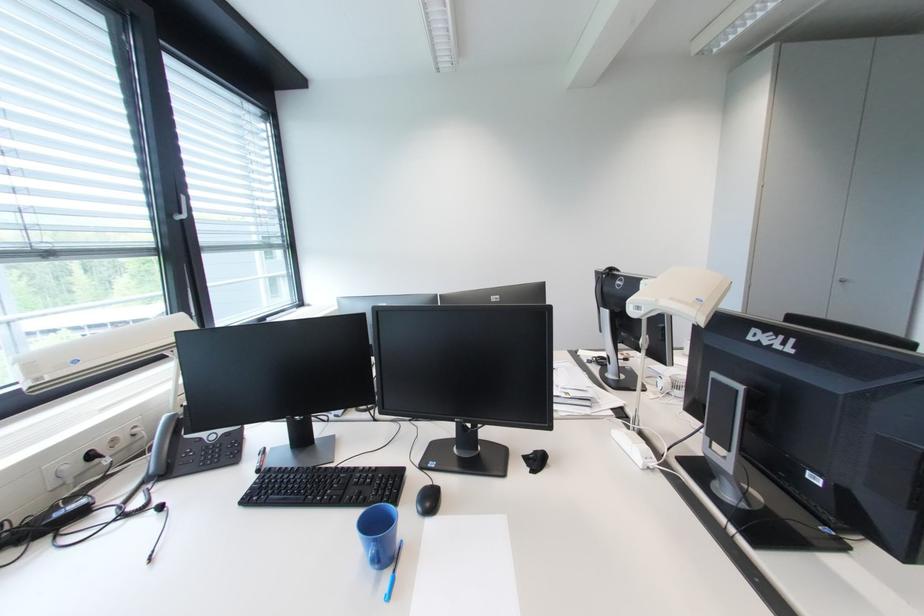
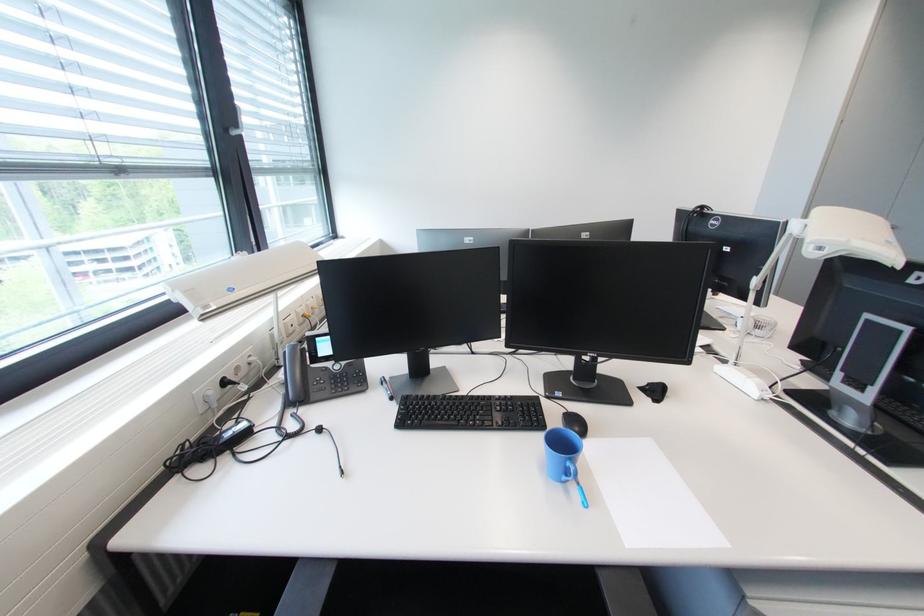
Find the pixel in the second image that matches the point at 663,302 in the first image.

(856, 243)